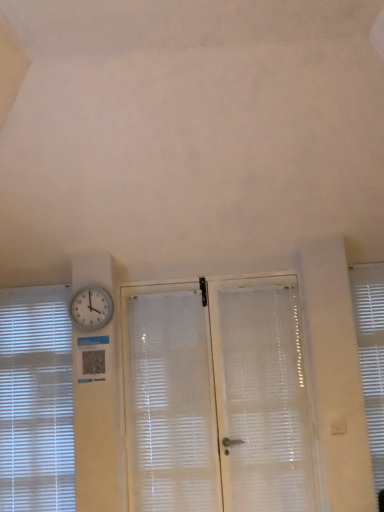
Question: Relative to white frosted glass screen door at center, is white translucent shutter at center in front or behind?

Choices:
 (A) behind
 (B) front

Answer: (B)

Question: From the image's perspective, is white translucent shutter at center positioned above or below white frosted glass screen door at center?

Choices:
 (A) above
 (B) below

Answer: (B)

Question: Estimate the real-world distances between objects in this image. Which object is farther from the white translucent blinds at left, which appears as the 2th window blind when viewed from the right?

Choices:
 (A) white glossy clock at upper left
 (B) white frosted glass screen door at center
 (C) white textured window blind at right, the second window blind positioned from the left
 (D) white translucent shutter at center

Answer: (C)

Question: Which is nearer to the white translucent shutter at center?

Choices:
 (A) white frosted glass screen door at center
 (B) white translucent blinds at left, which appears as the 2th window blind when viewed from the right
 (C) white textured window blind at right, the 1th window blind viewed from the right
 (D) white glossy clock at upper left

Answer: (A)